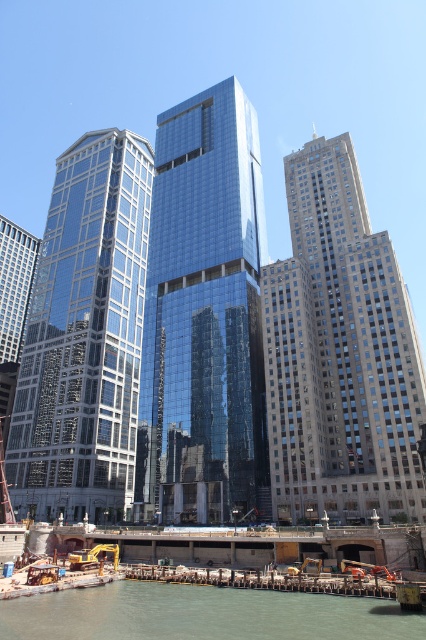
You are a drone operator flying over the urban scene. You need to deliver a package to the gray stone skyscraper at right and then to the shiny glass skyscraper at left. Which building will you reach first?

The gray stone skyscraper at right is closer to the viewer than the shiny glass skyscraper at left, so you will reach the gray stone skyscraper at right first.

You are a city planner assessing the skyline. You need to determine which of the two glass skyscrapers, the glossy glass skyscraper at center or the shiny glass skyscraper at left, is the taller one. Based on the scene, which one is taller?

The shiny glass skyscraper at left is taller than the glossy glass skyscraper at center.